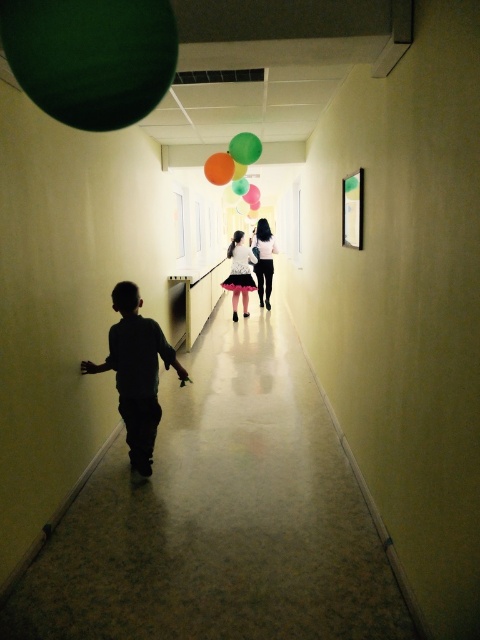
Can you confirm if green matte balloon at upper left is thinner than silhouette cotton shirt at center?

Indeed, green matte balloon at upper left has a lesser width compared to silhouette cotton shirt at center.

Can you confirm if green matte balloon at upper left is shorter than silhouette cotton shirt at center?

Yes.

The height and width of the screenshot is (640, 480). What do you see at coordinates (91, 56) in the screenshot?
I see `green matte balloon at upper left` at bounding box center [91, 56].

This screenshot has width=480, height=640. I want to click on green matte balloon at upper left, so click(91, 56).

Who is positioned more to the left, green matte balloon at upper left or green matte balloon at upper center?

green matte balloon at upper left is more to the left.

Between point (108, 108) and point (220, 157), which one is positioned behind?

Positioned behind is point (220, 157).

Who is more distant from viewer, (32,99) or (212,160)?

Point (212,160)

Find the location of a particular element. The image size is (480, 640). green matte balloon at upper left is located at coordinates (91, 56).

Which of these two, silhouette cotton shirt at center or green matte balloon at center, stands shorter?

green matte balloon at center

Can you confirm if silhouette cotton shirt at center is bigger than green matte balloon at center?

Correct, silhouette cotton shirt at center is larger in size than green matte balloon at center.

Which is in front, point (132, 358) or point (238, 152)?

Point (132, 358) is in front.

Where is `silhouette cotton shirt at center`? Image resolution: width=480 pixels, height=640 pixels. silhouette cotton shirt at center is located at coordinates (136, 372).